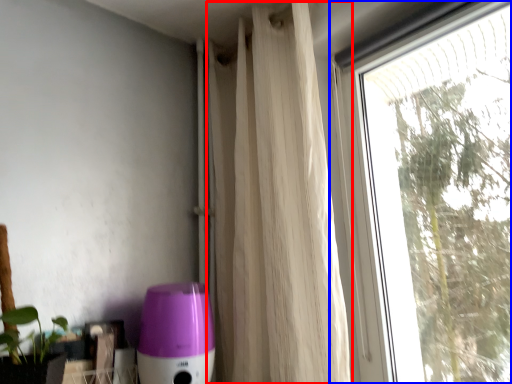
Question: Among these objects, which one is farthest to the camera, curtain (highlighted by a red box) or window (highlighted by a blue box)?

Choices:
 (A) curtain
 (B) window

Answer: (A)